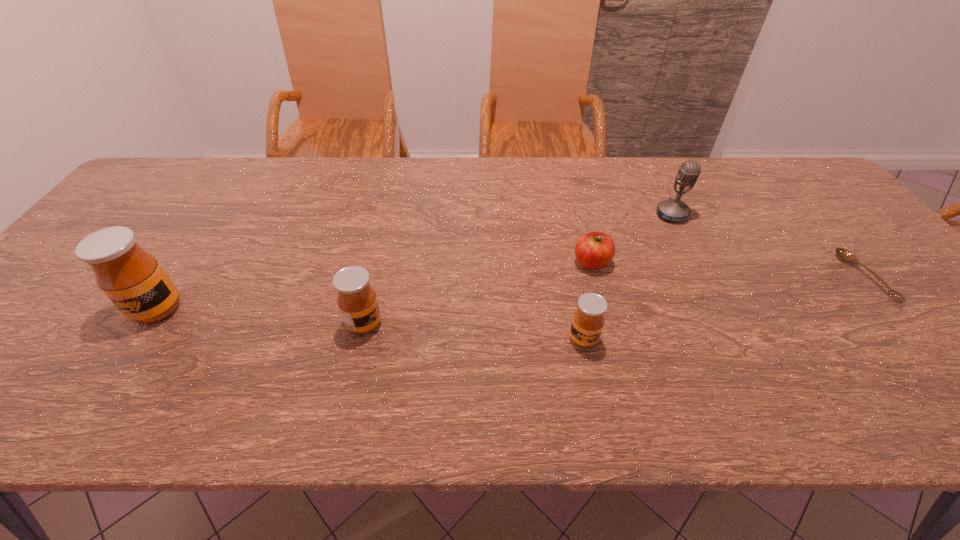
Image resolution: width=960 pixels, height=540 pixels. Find the location of `free space that is in between the leftmost honey and the microphone`. free space that is in between the leftmost honey and the microphone is located at coordinates (415, 262).

Image resolution: width=960 pixels, height=540 pixels. What are the coordinates of `blank region between the second object from left to right and the shortest object` in the screenshot? It's located at (614, 301).

This screenshot has width=960, height=540. What are the coordinates of `free space between the tallest object and the second shortest object` in the screenshot? It's located at (374, 286).

At what (x,y) coordinates should I click in order to perform the action: click on free space that is in between the leftmost object and the shortest object. Please return your answer as a coordinate pair (x, y). This screenshot has width=960, height=540. Looking at the image, I should click on (511, 293).

Identify which object is the third closest to the shortest honey. Please provide its 2D coordinates. Your answer should be formatted as a tuple, i.e. [(x, y)], where the tuple contains the x and y coordinates of a point satisfying the conditions above.

[(674, 210)]

Where is `the fourth closest object to the third shortest object`? This screenshot has width=960, height=540. the fourth closest object to the third shortest object is located at coordinates (845, 255).

Identify the location of the second closest honey to the shortest object. Image resolution: width=960 pixels, height=540 pixels. (357, 301).

At what (x,y) coordinates should I click in order to perform the action: click on the closest honey to the shortest object. Please return your answer as a coordinate pair (x, y). The height and width of the screenshot is (540, 960). Looking at the image, I should click on (588, 320).

Locate an element on the screen. This screenshot has width=960, height=540. free location that satisfies the following two spatial constraints: 1. on the front side of the second shortest object; 2. on the front-facing side of the second shortest honey is located at coordinates (607, 324).

Image resolution: width=960 pixels, height=540 pixels. In order to click on free space that satisfies the following two spatial constraints: 1. on the front side of the second shortest object; 2. on the front-facing side of the fourth shortest object in this screenshot , I will do `click(607, 324)`.